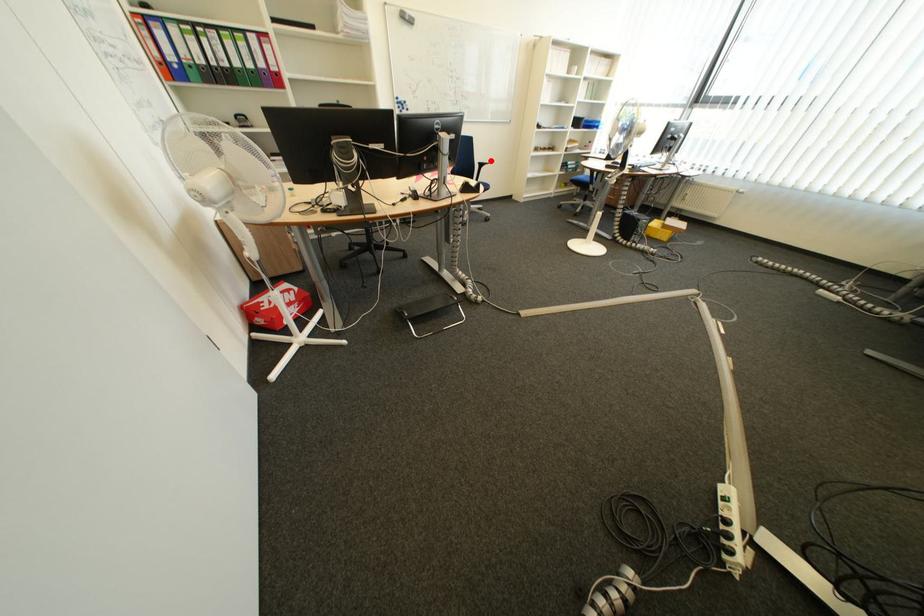
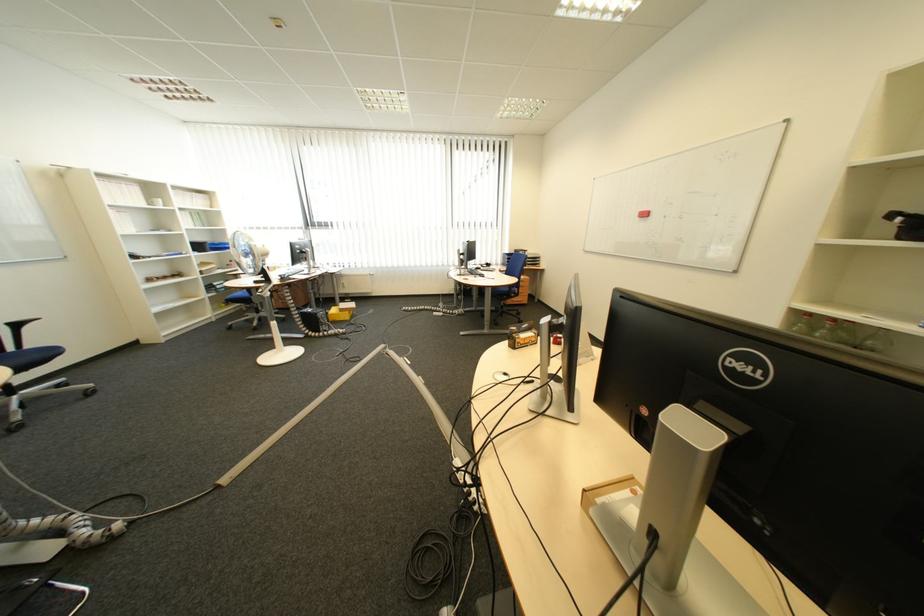
The point at the highlighted location is marked in the first image. Where is the corresponding point in the second image?

(13, 321)